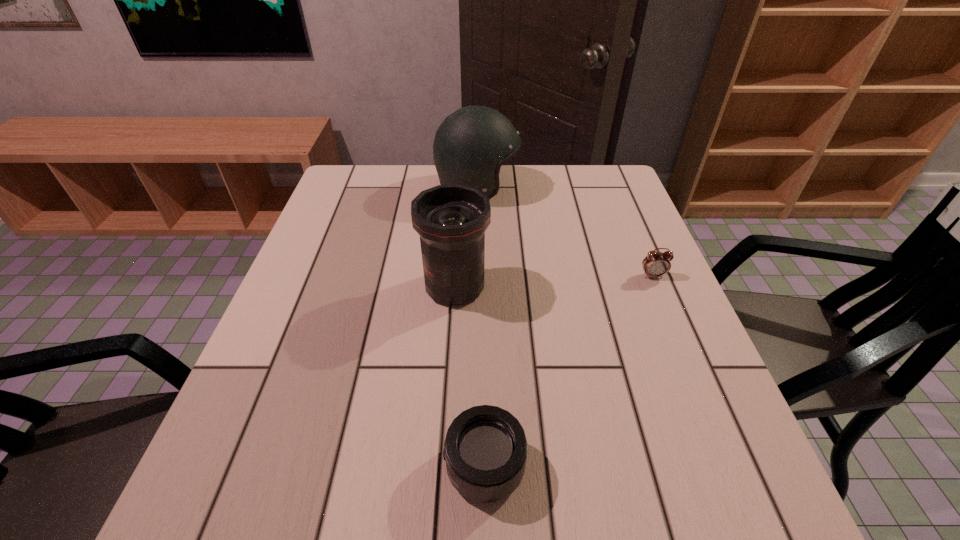
Identify the location of blank region between the shorter telephoto lens and the taller telephoto lens. (469, 376).

Find the location of `free space that is in between the nearest object and the alarm clock`. free space that is in between the nearest object and the alarm clock is located at coordinates (568, 371).

The height and width of the screenshot is (540, 960). I want to click on free point between the taller telephoto lens and the rightmost object, so click(x=554, y=281).

Locate an element on the screen. This screenshot has height=540, width=960. free space between the taller telephoto lens and the nearest object is located at coordinates (469, 376).

The height and width of the screenshot is (540, 960). I want to click on vacant area between the rightmost object and the taller telephoto lens, so click(554, 281).

Find the location of `vacant area that lies between the farther telephoto lens and the nearest object`. vacant area that lies between the farther telephoto lens and the nearest object is located at coordinates (469, 376).

Identify the location of vacant region between the nearer telephoto lens and the football helmet. (481, 327).

Where is `vacant region between the shorter telephoto lens and the taller telephoto lens`? vacant region between the shorter telephoto lens and the taller telephoto lens is located at coordinates (469, 376).

What are the coordinates of `free spot between the rightmost object and the farthest object` in the screenshot? It's located at (565, 232).

I want to click on free space between the nearest object and the taller telephoto lens, so click(469, 376).